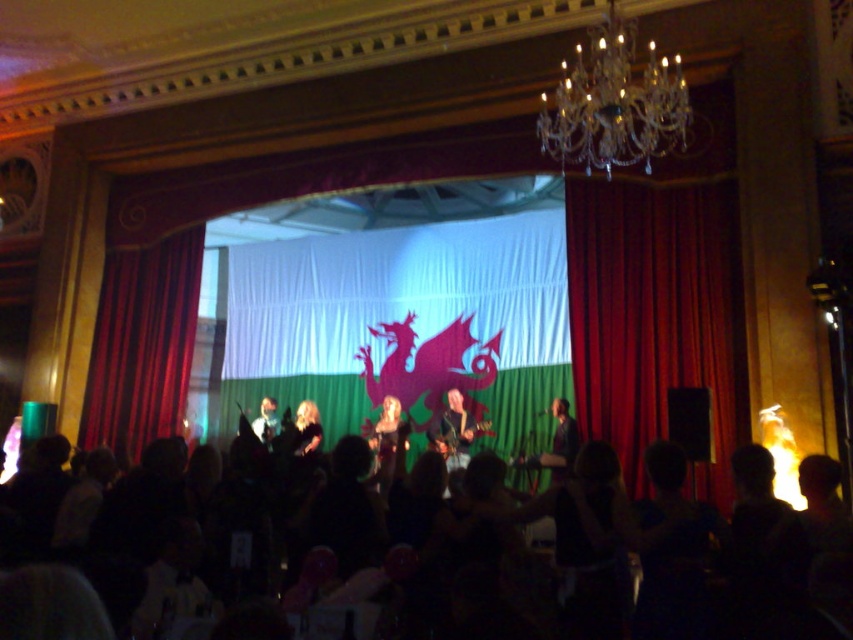
Question: Which object appears farthest from the camera in this image?

Choices:
 (A) smooth black shirt at center
 (B) blonde hair at center
 (C) silhouette crowd at center

Answer: (A)

Question: Does red velvet curtain at right have a larger size compared to smooth black shirt at center?

Choices:
 (A) yes
 (B) no

Answer: (A)

Question: Observing the image, what is the correct spatial positioning of clear crystal chandelier at upper center in reference to matte black guitar at center?

Choices:
 (A) left
 (B) right

Answer: (B)

Question: Is clear crystal chandelier at upper center wider than smooth black shirt at center?

Choices:
 (A) no
 (B) yes

Answer: (B)

Question: Based on their relative distances, which object is nearer to the smooth black shirt at center?

Choices:
 (A) matte black dress at center
 (B) silhouette crowd at center
 (C) blonde hair at center
 (D) matte black guitar at center

Answer: (C)

Question: Which of the following is the closest to the observer?

Choices:
 (A) (635, 308)
 (B) (373, 448)
 (C) (627, 150)
 (D) (561, 474)

Answer: (C)